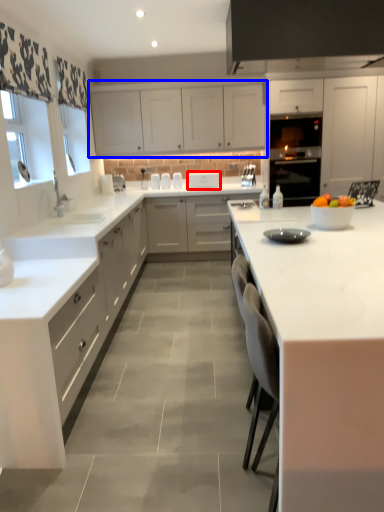
Question: Which object is further to the camera taking this photo, appliance (highlighted by a red box) or cabinetry (highlighted by a blue box)?

Choices:
 (A) appliance
 (B) cabinetry

Answer: (A)